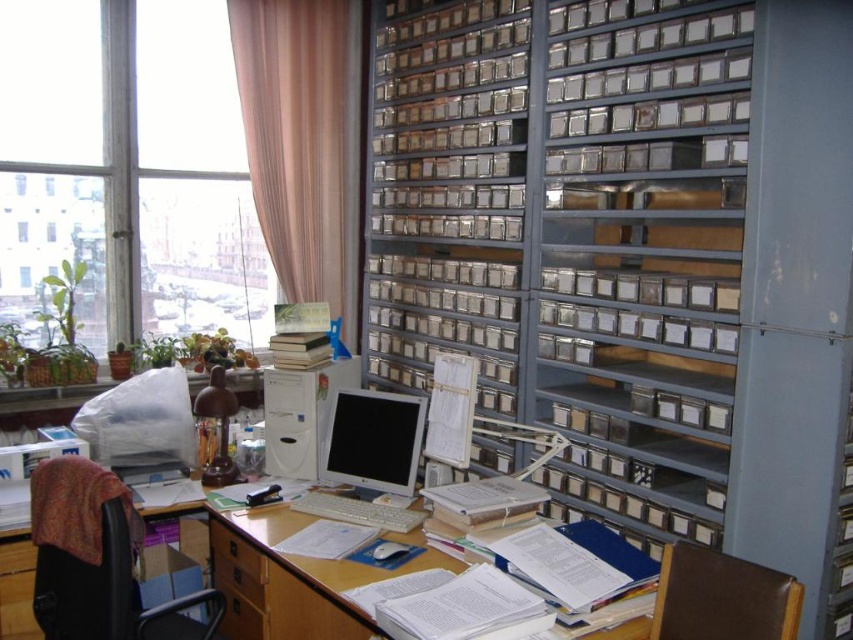
You are organizing your workspace and need to place a new 20cm wide notebook on the wooden desk at center. Considering the white glossy computer monitor at center is already occupying space, can the notebook fit on the desk without overlapping the monitor?

The wooden desk at center has a larger width than the white glossy computer monitor at center, so there should be enough space to place the 20cm wide notebook on the desk without overlapping the monitor.

You are standing in the workspace and want to place a small plant between the two points, point [109,275] and point [22,236]. Since you want the plant to be closer to you, which point should you position it near?

To place the plant closer to you, position it near point [109,275] because it is closer to the viewer compared to point [22,236].

You are an office assistant who needs to place a new monitor on the wooden desk at center. The desk has limited space. Can you determine if the monitor will fit based on its dimensions?

The wooden desk at center is located at point (474, 536), but without specific dimensions of the desk or the monitor, it is impossible to determine if the monitor will fit. Please provide more information about the desk size and monitor dimensions.